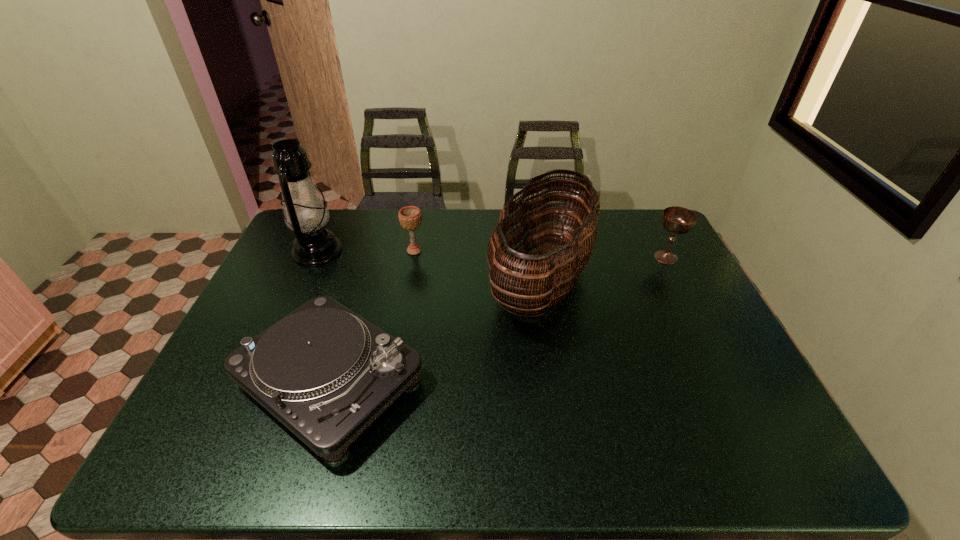
Find the location of a particular element. oil lamp is located at coordinates (305, 212).

At what (x,y) coordinates should I click in order to perform the action: click on the second object from right to left. Please return your answer as a coordinate pair (x, y). Image resolution: width=960 pixels, height=540 pixels. Looking at the image, I should click on (540, 283).

At what (x,y) coordinates should I click in order to perform the action: click on basket. Please return your answer as a coordinate pair (x, y). The width and height of the screenshot is (960, 540). Looking at the image, I should click on (540, 283).

Identify the location of the right chalice. This screenshot has height=540, width=960. (678, 220).

This screenshot has width=960, height=540. Identify the location of the left chalice. (410, 217).

Where is `the shortest object`? The width and height of the screenshot is (960, 540). the shortest object is located at coordinates (326, 373).

Find the location of `vacant region located 0.200m on the front of the oil lamp`. vacant region located 0.200m on the front of the oil lamp is located at coordinates (288, 315).

Locate an element on the screen. vacant space located 0.400m on the left of the second object from right to left is located at coordinates (356, 279).

Locate an element on the screen. This screenshot has width=960, height=540. free spot located on the front of the right chalice is located at coordinates (687, 300).

Where is `free point located on the left of the left chalice`? The height and width of the screenshot is (540, 960). free point located on the left of the left chalice is located at coordinates (376, 251).